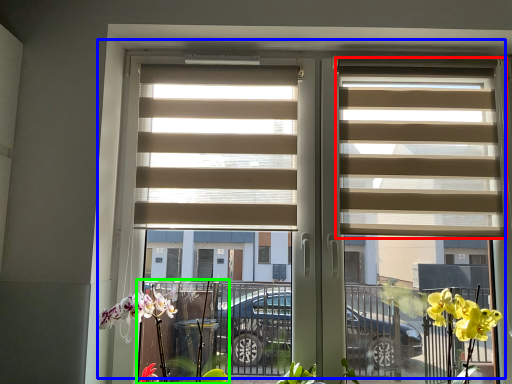
Question: Based on their relative distances, which object is nearer to window blind (highlighted by a red box)? Choose from window (highlighted by a blue box) and plant (highlighted by a green box).

Choices:
 (A) window
 (B) plant

Answer: (A)